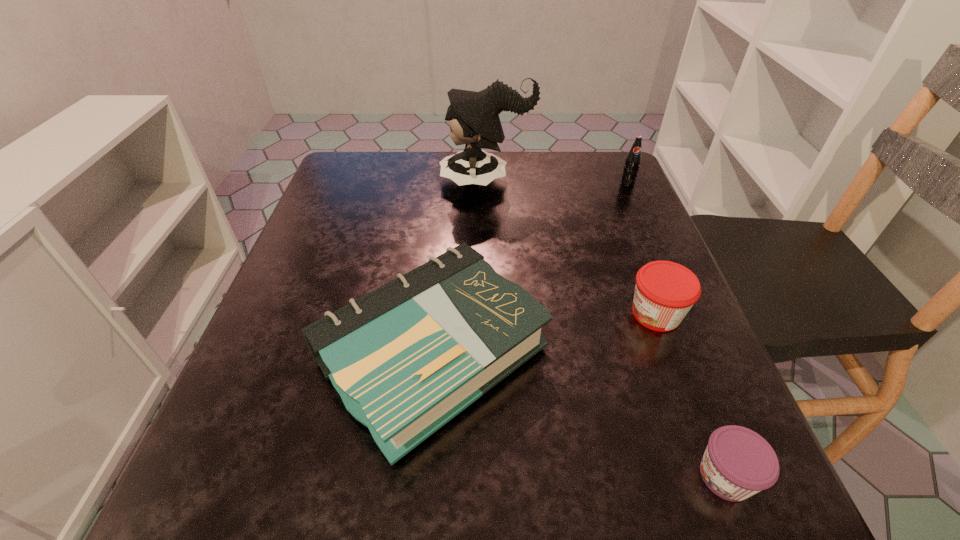
This screenshot has height=540, width=960. What are the coordinates of `free point located 0.130m on the back of the paperback book` in the screenshot? It's located at (444, 233).

Identify the location of free space located 0.110m on the label side of the taller jam. This screenshot has height=540, width=960. (564, 314).

You are a GUI agent. You are given a task and a screenshot of the screen. Output one action in this format:
    pyautogui.click(x=<x>, y=<y>)
    Task: Click on the free space located on the label side of the taller jam
    Image resolution: width=960 pixels, height=540 pixels.
    Given the screenshot: What is the action you would take?
    pyautogui.click(x=576, y=314)

Identify the location of vacant space located 0.310m on the label side of the taller jam. The height and width of the screenshot is (540, 960). (452, 314).

Where is `free space located on the front label of the shortest object`? This screenshot has height=540, width=960. free space located on the front label of the shortest object is located at coordinates 406,476.

This screenshot has height=540, width=960. I want to click on vacant area located 0.220m on the front label of the shortest object, so click(x=527, y=476).

Where is `blank space located 0.380m on the front label of the shortest object`? The image size is (960, 540). blank space located 0.380m on the front label of the shortest object is located at coordinates (406, 476).

Identify the location of doll present at the far edge. Image resolution: width=960 pixels, height=540 pixels. (473, 117).

This screenshot has width=960, height=540. What are the coordinates of `pop that is at the far edge` in the screenshot? It's located at (632, 162).

At what (x,y) coordinates should I click in order to perform the action: click on paperback book positioned at the near edge. Please return your answer as a coordinate pair (x, y). Image resolution: width=960 pixels, height=540 pixels. Looking at the image, I should click on (406, 358).